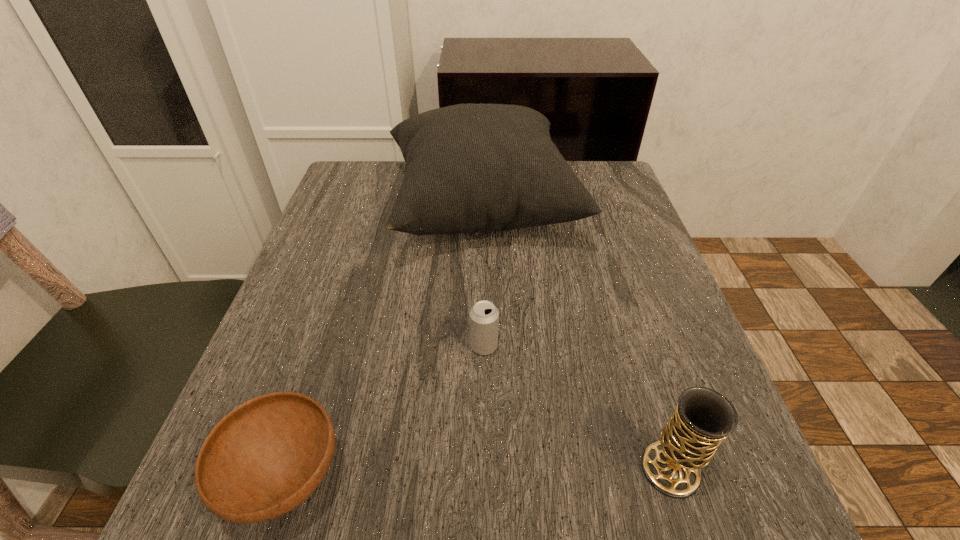
Locate an element on the screen. The width and height of the screenshot is (960, 540). cushion that is positioned at the right edge is located at coordinates (470, 167).

At what (x,y) coordinates should I click in order to perform the action: click on chalice located at the right edge. Please return your answer as a coordinate pair (x, y). This screenshot has height=540, width=960. Looking at the image, I should click on (703, 418).

The width and height of the screenshot is (960, 540). Find the location of `object present at the far left corner`. object present at the far left corner is located at coordinates (x=470, y=167).

Where is `object located at the far right corner`? This screenshot has width=960, height=540. object located at the far right corner is located at coordinates (470, 167).

The image size is (960, 540). I want to click on object that is at the near right corner, so click(x=703, y=418).

Locate an element on the screen. The width and height of the screenshot is (960, 540). free region at the left edge is located at coordinates (356, 287).

Image resolution: width=960 pixels, height=540 pixels. In order to click on free region at the right edge in this screenshot , I will do `click(593, 239)`.

What are the coordinates of `blank space at the far left corner of the desktop` in the screenshot? It's located at click(357, 170).

The width and height of the screenshot is (960, 540). In order to click on blank area at the far right corner in this screenshot , I will do click(597, 173).

The height and width of the screenshot is (540, 960). In order to click on vacant space that's between the chalice and the farthest object in this screenshot , I will do `click(576, 340)`.